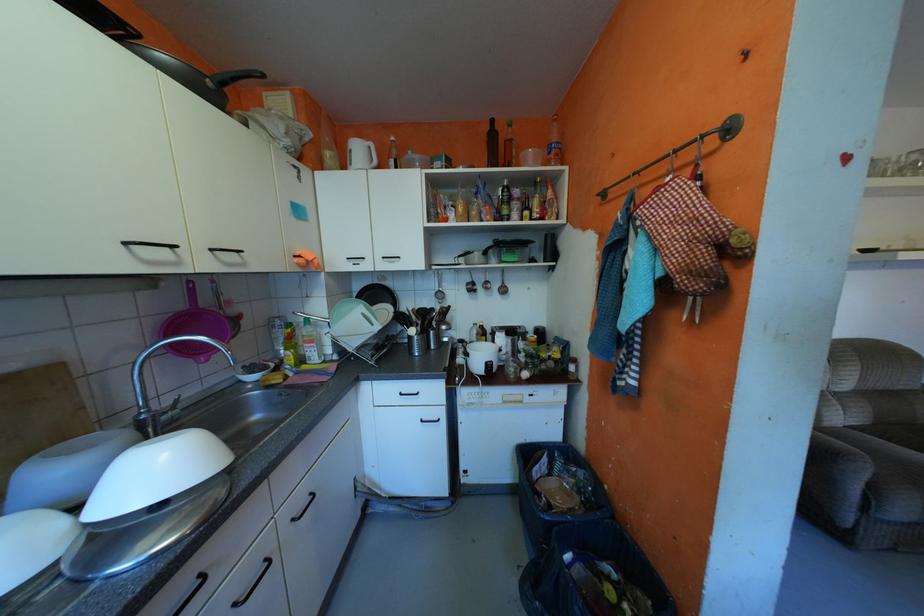
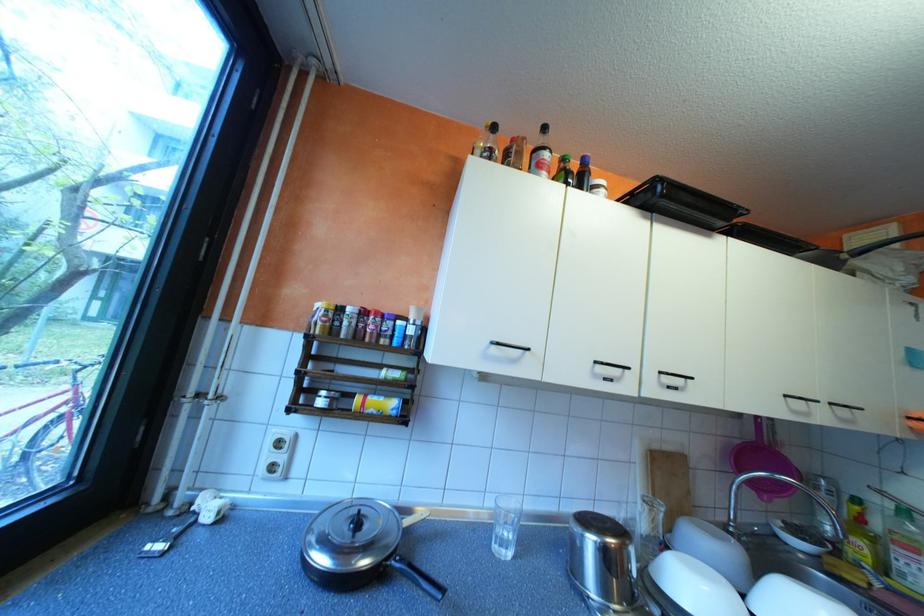
Where in the second image is the point corresponding to point (223, 249) from the first image?

(843, 403)